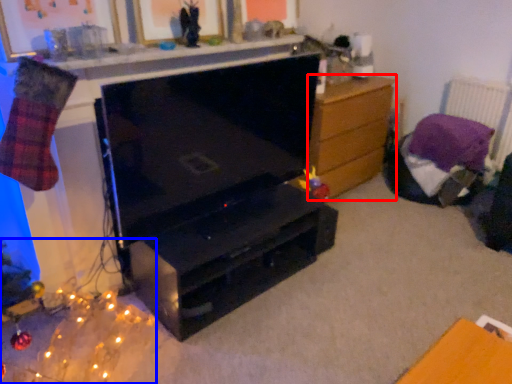
Question: Among these objects, which one is farthest to the camera, chest of drawers (highlighted by a red box) or christmas decoration (highlighted by a blue box)?

Choices:
 (A) chest of drawers
 (B) christmas decoration

Answer: (A)